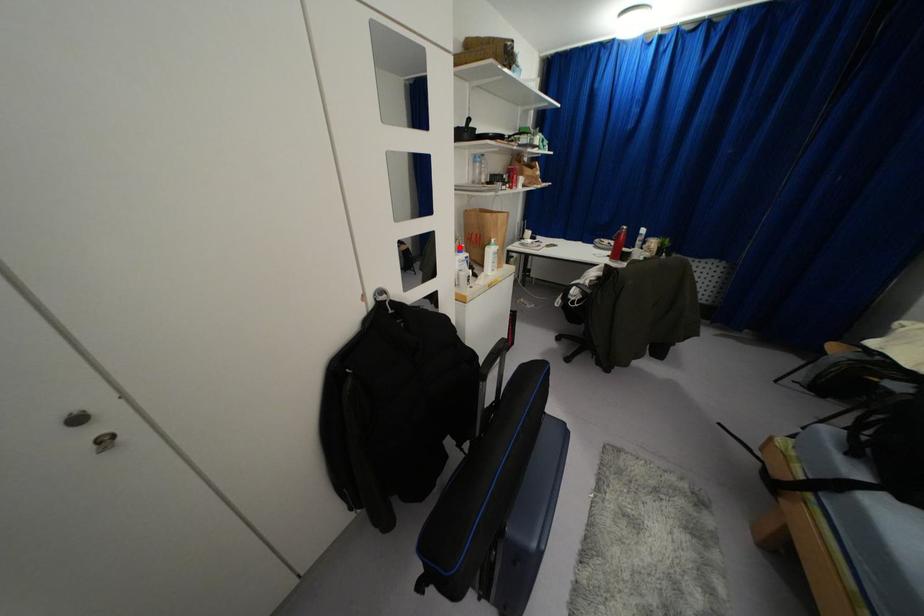
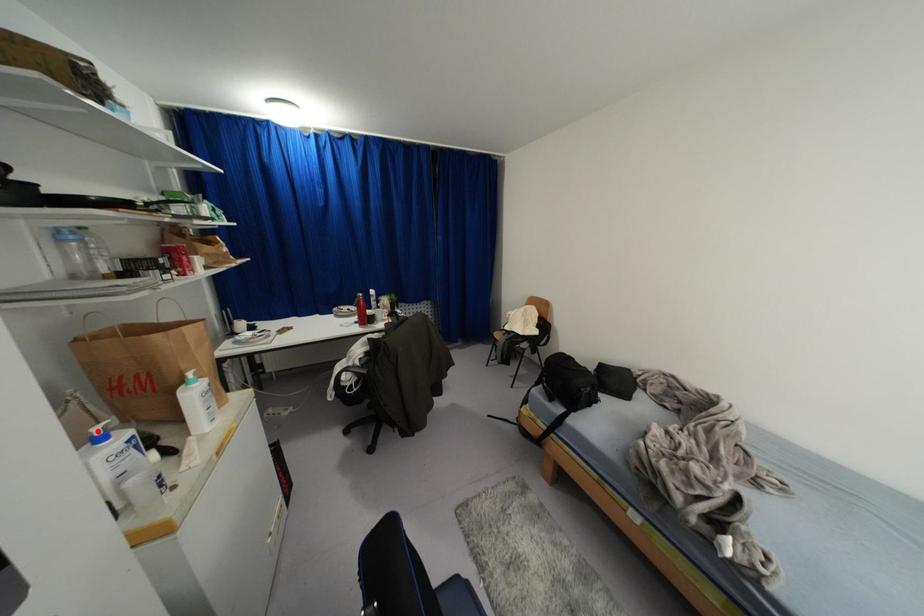
I am providing you with two images of the same scene from different viewpoints. A red point is marked on the first image and another point is marked on the second image. Is the marked point in image1 the same physical position as the marked point in image2?

Yes